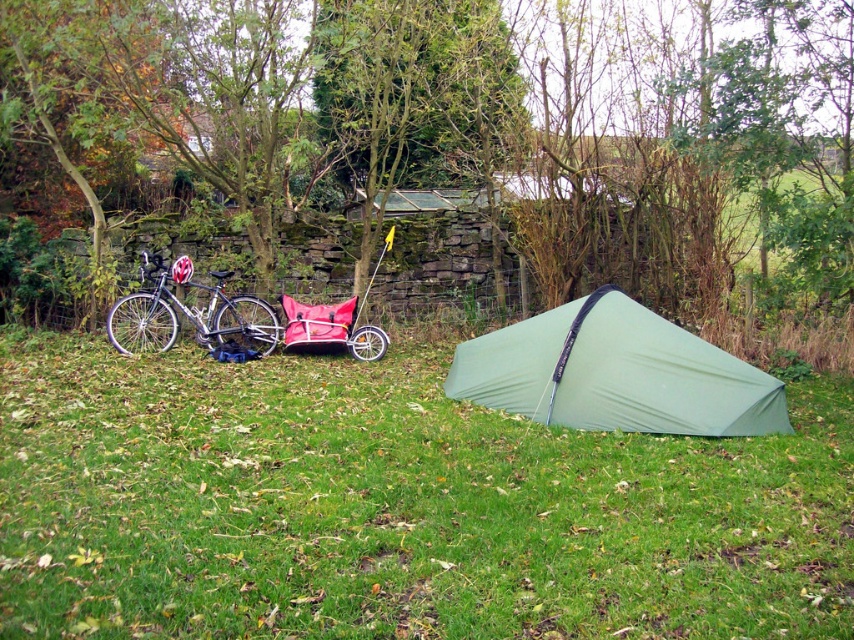
You are a parent trying to decide whether to use the shiny silver bicycle at left or the red fabric baby carriage at center to carry your child. Considering their heights, which one would allow your child to be seen more easily from behind?

The shiny silver bicycle at left is taller than the red fabric baby carriage at center, so the child would be more visible from behind when using the shiny silver bicycle at left.

You are a hiker who wants to set up a tent in this area. Based on the image, where should you place the green fabric tent at center to avoid placing it on the green grassy at center?

The green grassy at center is below the green fabric tent at center, so you should place the green fabric tent at center on the green grassy at center since it is already positioned there.

You are planning to move the shiny silver bicycle at left and the red fabric baby carriage at center through a narrow garden path. Which object should you move first to ensure they both fit through the path without overlapping?

You should move the red fabric baby carriage at center first because the shiny silver bicycle at left is wider than the red fabric baby carriage at center, so moving the narrower one first allows better maneuvering space.